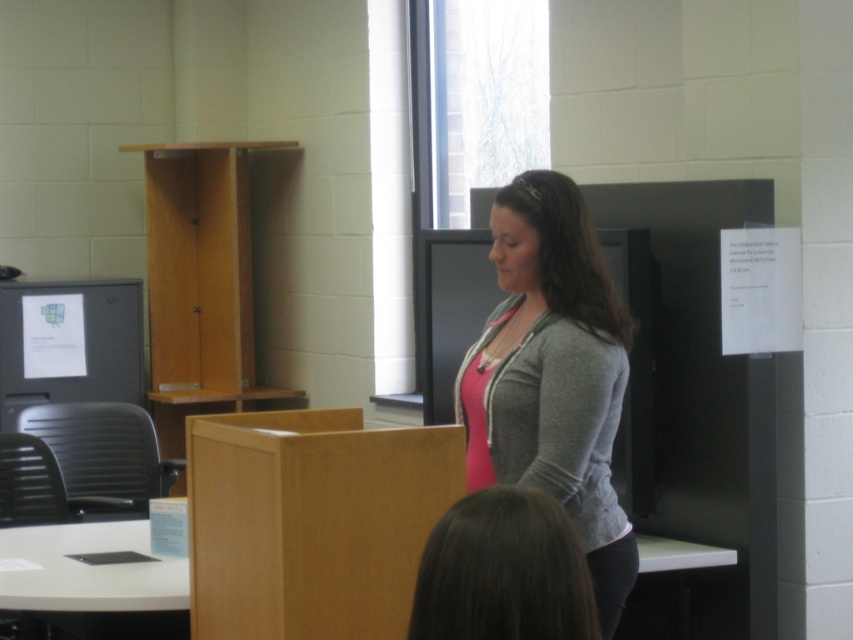
Which is above, brown smooth hair at lower center or matte black monitor at left?

matte black monitor at left

Does point (421, 598) lie behind point (33, 381)?

No.

Image resolution: width=853 pixels, height=640 pixels. I want to click on brown smooth hair at lower center, so 503,572.

Does gray fleece jacket at center have a lesser width compared to matte black monitor at left?

Indeed, gray fleece jacket at center has a lesser width compared to matte black monitor at left.

Does point (535, 372) lie in front of point (70, 316)?

Yes.

Is point (618, 577) positioned after point (71, 305)?

No, (618, 577) is closer to viewer.

Where is `gray fleece jacket at center`? gray fleece jacket at center is located at coordinates (553, 374).

Who is positioned more to the right, gray fleece jacket at center or brown smooth hair at lower center?

gray fleece jacket at center

Is gray fleece jacket at center below brown smooth hair at lower center?

No.

In the scene shown: Who is more distant from viewer, (x=527, y=358) or (x=566, y=538)?

The point (x=527, y=358) is more distant.

Image resolution: width=853 pixels, height=640 pixels. In order to click on gray fleece jacket at center in this screenshot , I will do `click(553, 374)`.